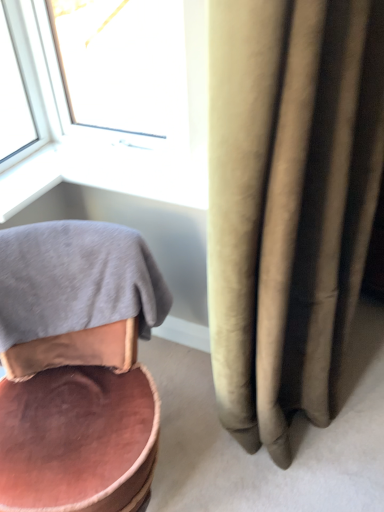
Question: Can you confirm if white plastic window at upper left is shorter than pink velvet chair at lower left?

Choices:
 (A) no
 (B) yes

Answer: (B)

Question: Can you confirm if white plastic window at upper left is positioned to the right of pink velvet chair at lower left?

Choices:
 (A) yes
 (B) no

Answer: (A)

Question: Can you confirm if white plastic window at upper left is thinner than pink velvet chair at lower left?

Choices:
 (A) no
 (B) yes

Answer: (B)

Question: Does white plastic window at upper left lie in front of pink velvet chair at lower left?

Choices:
 (A) yes
 (B) no

Answer: (B)

Question: Does white plastic window at upper left come behind pink velvet chair at lower left?

Choices:
 (A) yes
 (B) no

Answer: (A)

Question: Can you confirm if white plastic window at upper left is bigger than pink velvet chair at lower left?

Choices:
 (A) no
 (B) yes

Answer: (A)

Question: Can you confirm if white plastic window at upper left is smaller than gray cotton bath towel at lower left?

Choices:
 (A) no
 (B) yes

Answer: (B)

Question: Does white plastic window at upper left lie behind gray cotton bath towel at lower left?

Choices:
 (A) no
 (B) yes

Answer: (B)

Question: Is white plastic window at upper left positioned with its back to gray cotton bath towel at lower left?

Choices:
 (A) no
 (B) yes

Answer: (A)

Question: Is white plastic window at upper left to the right of gray cotton bath towel at lower left from the viewer's perspective?

Choices:
 (A) no
 (B) yes

Answer: (B)

Question: Could gray cotton bath towel at lower left be considered to be inside white plastic window at upper left?

Choices:
 (A) no
 (B) yes

Answer: (A)

Question: From a real-world perspective, is white plastic window at upper left below gray cotton bath towel at lower left?

Choices:
 (A) yes
 (B) no

Answer: (B)

Question: Is the depth of gray cotton bath towel at lower left less than that of pink velvet chair at lower left?

Choices:
 (A) no
 (B) yes

Answer: (A)